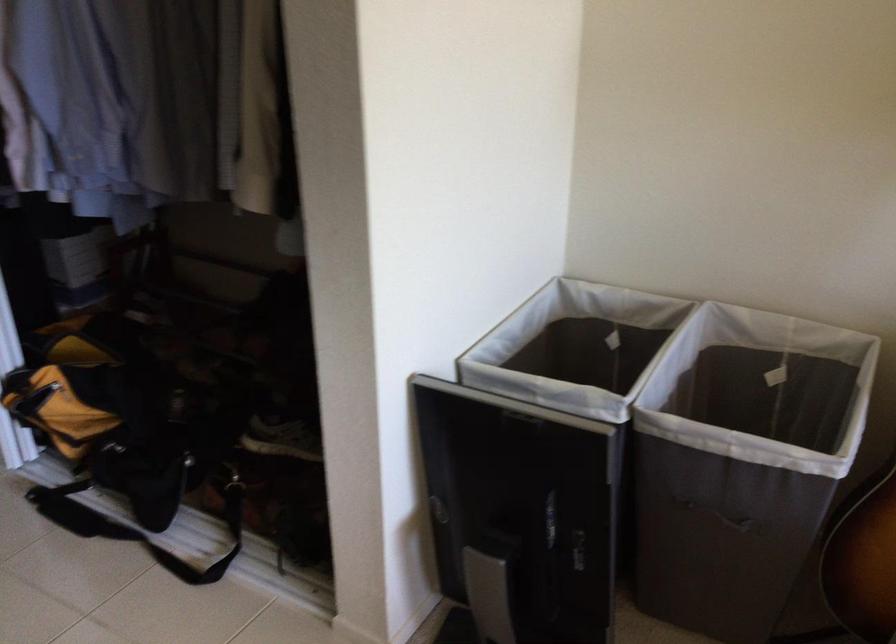
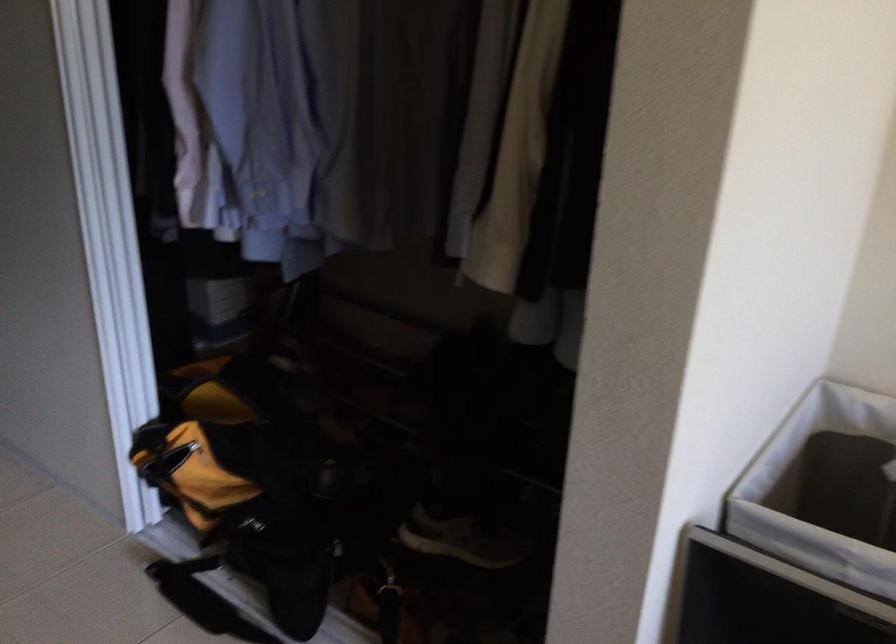
Locate, in the second image, the point that corresponds to point 572,357 in the first image.

(824, 489)